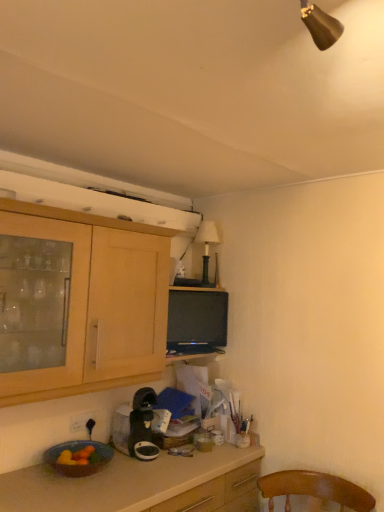
Question: Is green matte lamp at upper center to the left or to the right of light wood cabinet at upper left in the image?

Choices:
 (A) right
 (B) left

Answer: (A)

Question: Is point (205, 226) closer or farther from the camera than point (79, 348)?

Choices:
 (A) farther
 (B) closer

Answer: (A)

Question: Estimate the real-world distances between objects in this image. Which object is closer to the matte black tv at center?

Choices:
 (A) matte ceramic bowl at lower left
 (B) white plastic power outlet at lower left
 (C) light wood cabinet at upper left
 (D) green matte lamp at upper center
 (E) black plastic coffee maker at lower center

Answer: (D)

Question: Considering the real-world distances, which object is farthest from the light wood cabinet at upper left?

Choices:
 (A) matte ceramic bowl at lower left
 (B) matte black tv at center
 (C) white plastic power outlet at lower left
 (D) green matte lamp at upper center
 (E) black plastic coffee maker at lower center

Answer: (D)